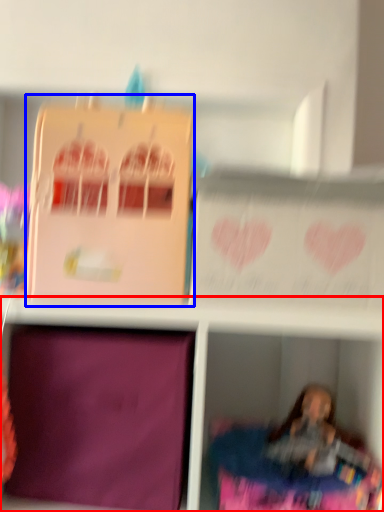
Question: Which point is closer to the camera, shelf (highlighted by a red box) or cardboard box (highlighted by a blue box)?

Choices:
 (A) shelf
 (B) cardboard box

Answer: (A)